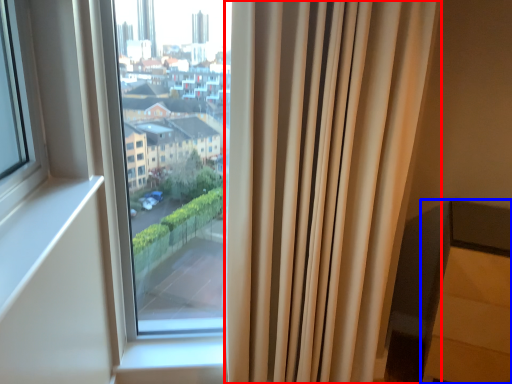
Question: Which object is closer to the camera taking this photo, curtain (highlighted by a red box) or furniture (highlighted by a blue box)?

Choices:
 (A) curtain
 (B) furniture

Answer: (A)